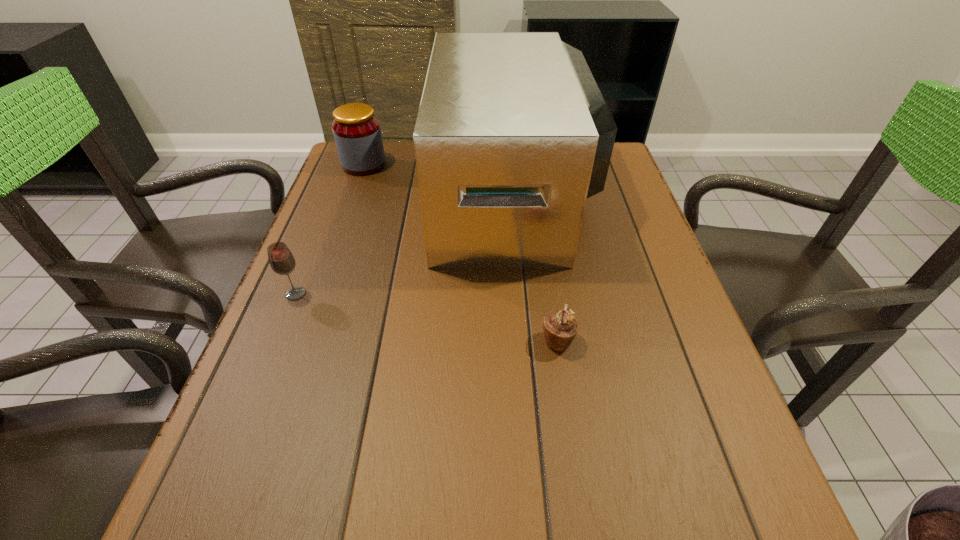
At what (x,y) coordinates should I click in order to perform the action: click on free point located on the back of the third tallest object. Please return your answer as a coordinate pair (x, y). This screenshot has width=960, height=540. Looking at the image, I should click on (325, 219).

Where is `blank area located on the front of the shortest object`? The width and height of the screenshot is (960, 540). blank area located on the front of the shortest object is located at coordinates (574, 447).

Where is `microwave oven that is at the far edge`? microwave oven that is at the far edge is located at coordinates (512, 136).

Locate an element on the screen. jar that is at the far edge is located at coordinates (356, 130).

Where is `jar positioned at the left edge`? The width and height of the screenshot is (960, 540). jar positioned at the left edge is located at coordinates (356, 130).

Where is `glass drink container positioned at the left edge`? The image size is (960, 540). glass drink container positioned at the left edge is located at coordinates (282, 262).

The height and width of the screenshot is (540, 960). What are the coordinates of `object that is at the right edge` in the screenshot? It's located at (512, 136).

This screenshot has height=540, width=960. I want to click on object at the far left corner, so click(x=356, y=130).

Locate an element on the screen. Image resolution: width=960 pixels, height=540 pixels. object located in the far right corner section of the desktop is located at coordinates (512, 136).

At what (x,y) coordinates should I click in order to perform the action: click on free location at the near edge. Please return your answer as a coordinate pair (x, y). The width and height of the screenshot is (960, 540). Looking at the image, I should click on (571, 501).